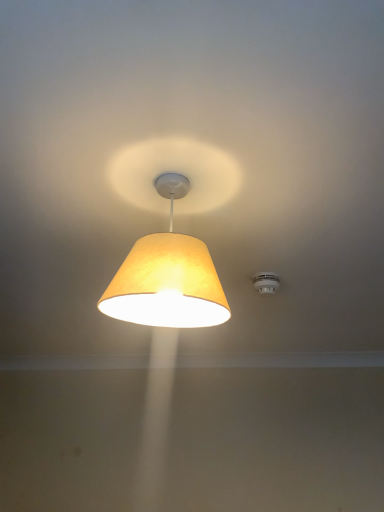
Question: Can you confirm if white plastic smoke detector at upper right is positioned to the right of matte yellow fabric lampshade at center?

Choices:
 (A) no
 (B) yes

Answer: (B)

Question: From the image's perspective, is white plastic smoke detector at upper right beneath matte yellow fabric lampshade at center?

Choices:
 (A) no
 (B) yes

Answer: (B)

Question: Can you confirm if white plastic smoke detector at upper right is thinner than matte yellow fabric lampshade at center?

Choices:
 (A) yes
 (B) no

Answer: (A)

Question: Is white plastic smoke detector at upper right next to matte yellow fabric lampshade at center and touching it?

Choices:
 (A) yes
 (B) no

Answer: (B)

Question: Is white plastic smoke detector at upper right not within matte yellow fabric lampshade at center?

Choices:
 (A) no
 (B) yes

Answer: (B)

Question: Is white plastic smoke detector at upper right positioned in front of matte yellow fabric lampshade at center?

Choices:
 (A) no
 (B) yes

Answer: (A)

Question: Is matte yellow fabric lampshade at center bigger than white plastic smoke detector at upper right?

Choices:
 (A) no
 (B) yes

Answer: (B)

Question: Is matte yellow fabric lampshade at center beside white plastic smoke detector at upper right?

Choices:
 (A) no
 (B) yes

Answer: (A)

Question: Does matte yellow fabric lampshade at center come behind white plastic smoke detector at upper right?

Choices:
 (A) yes
 (B) no

Answer: (B)

Question: From the image's perspective, does matte yellow fabric lampshade at center appear higher than white plastic smoke detector at upper right?

Choices:
 (A) no
 (B) yes

Answer: (B)

Question: Is white plastic smoke detector at upper right at the back of matte yellow fabric lampshade at center?

Choices:
 (A) no
 (B) yes

Answer: (A)

Question: Does matte yellow fabric lampshade at center have a greater height compared to white plastic smoke detector at upper right?

Choices:
 (A) no
 (B) yes

Answer: (B)

Question: Considering the relative positions of matte yellow fabric lampshade at center and white plastic smoke detector at upper right in the image provided, is matte yellow fabric lampshade at center to the left or to the right of white plastic smoke detector at upper right?

Choices:
 (A) right
 (B) left

Answer: (B)